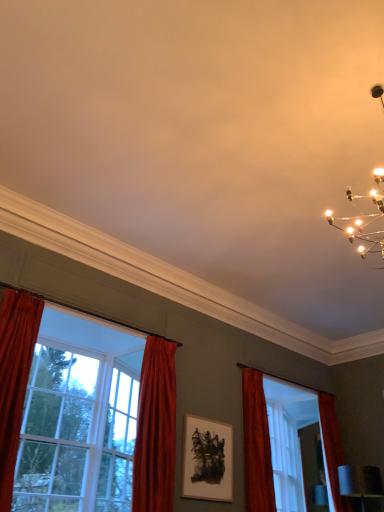
Question: Considering the positions of point (200, 476) and point (269, 504), is point (200, 476) closer or farther from the camera than point (269, 504)?

Choices:
 (A) farther
 (B) closer

Answer: (B)

Question: Visually, is wooden picture frame at center positioned to the left or to the right of velvet red curtain at right, the 1th curtain viewed from the right?

Choices:
 (A) right
 (B) left

Answer: (B)

Question: Based on their relative distances, which object is nearer to the velvet red curtain at center, acting as the 2th curtain starting from the right?

Choices:
 (A) wooden picture frame at center
 (B) velvet red curtain at right, the 1th curtain viewed from the right
 (C) matte red curtain at center, arranged as the first window when viewed from the right
 (D) clear glass window at left, the 2th window positioned from the left
 (E) clear glass window at left, positioned as the 1th window in left-to-right order

Answer: (D)

Question: Which of these objects is positioned farthest from the wooden picture frame at center?

Choices:
 (A) matte red curtain at center, arranged as the first window when viewed from the right
 (B) velvet red curtain at center, acting as the 2th curtain starting from the right
 (C) clear glass window at left, the 2th window positioned from the left
 (D) velvet red curtain at right, the 1th curtain viewed from the right
 (E) clear glass window at left, positioned as the 1th window in left-to-right order

Answer: (E)